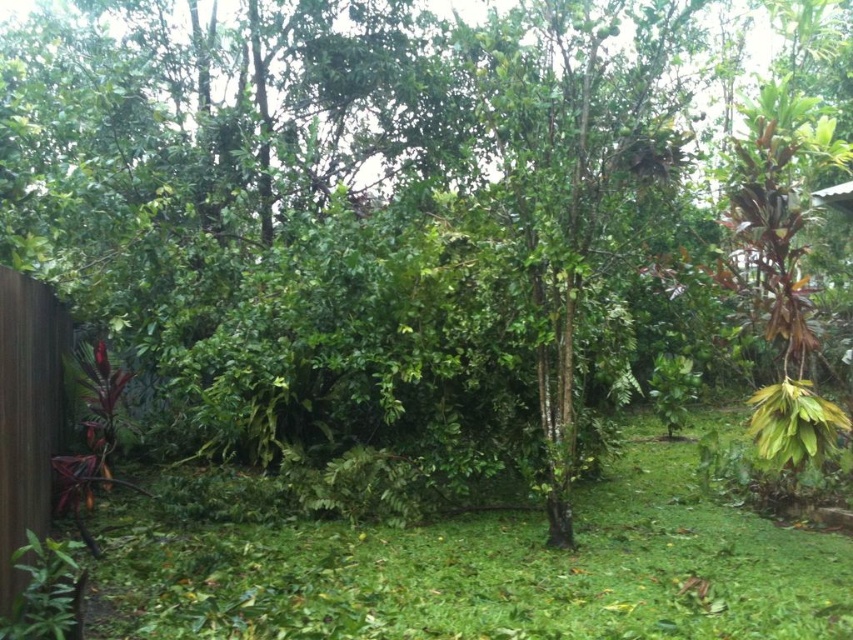
Which of these two, green grass at lower left or brown wood fence at left, stands shorter?

Standing shorter between the two is green grass at lower left.

Who is higher up, green grass at lower left or brown wood fence at left?

brown wood fence at left

Find the location of a particular element. green grass at lower left is located at coordinates (477, 570).